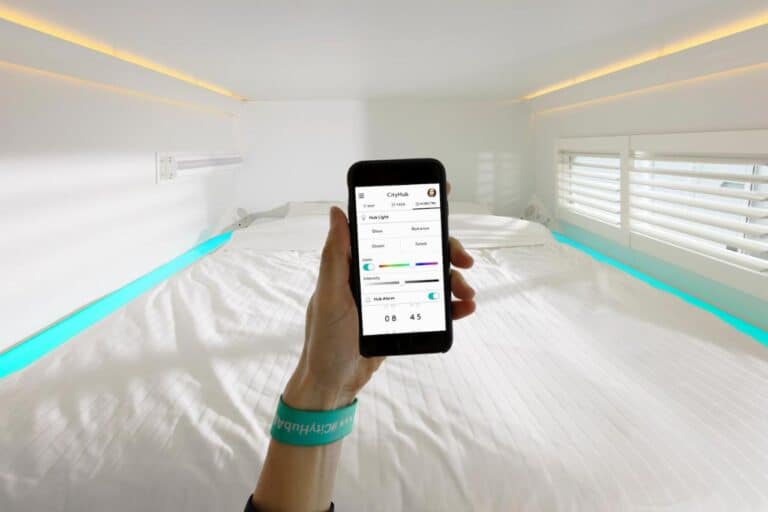
The image size is (768, 512). I want to click on white blanket, so pyautogui.click(x=511, y=398).